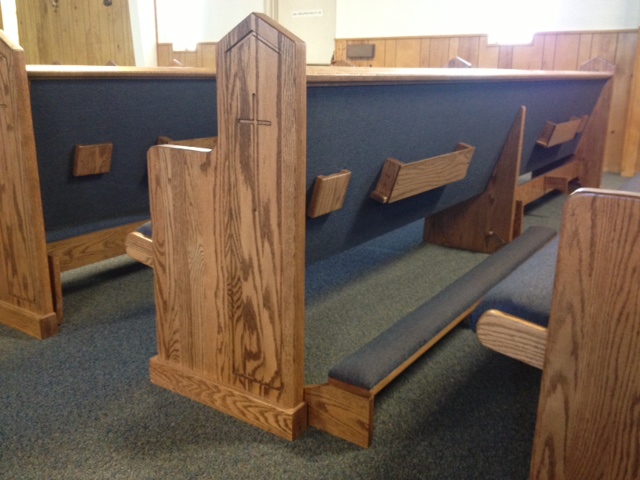
Image resolution: width=640 pixels, height=480 pixels. In order to click on wood engraved cross in this screenshot , I will do `click(255, 132)`.